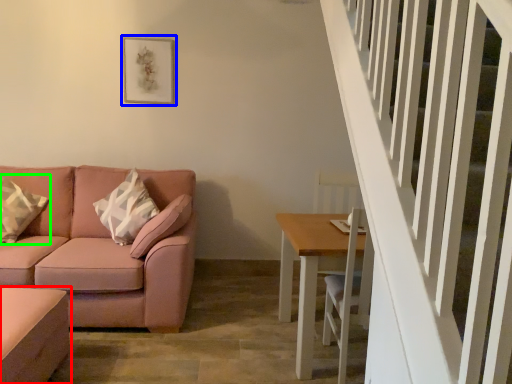
Question: Estimate the real-world distances between objects in this image. Which object is farther from table (highlighted by a red box), picture frame (highlighted by a blue box) or pillow (highlighted by a green box)?

Choices:
 (A) picture frame
 (B) pillow

Answer: (A)